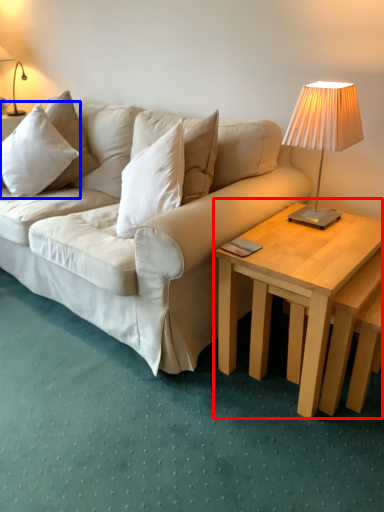
Question: Which object is further to the camera taking this photo, coffee table (highlighted by a red box) or pillow (highlighted by a blue box)?

Choices:
 (A) coffee table
 (B) pillow

Answer: (B)